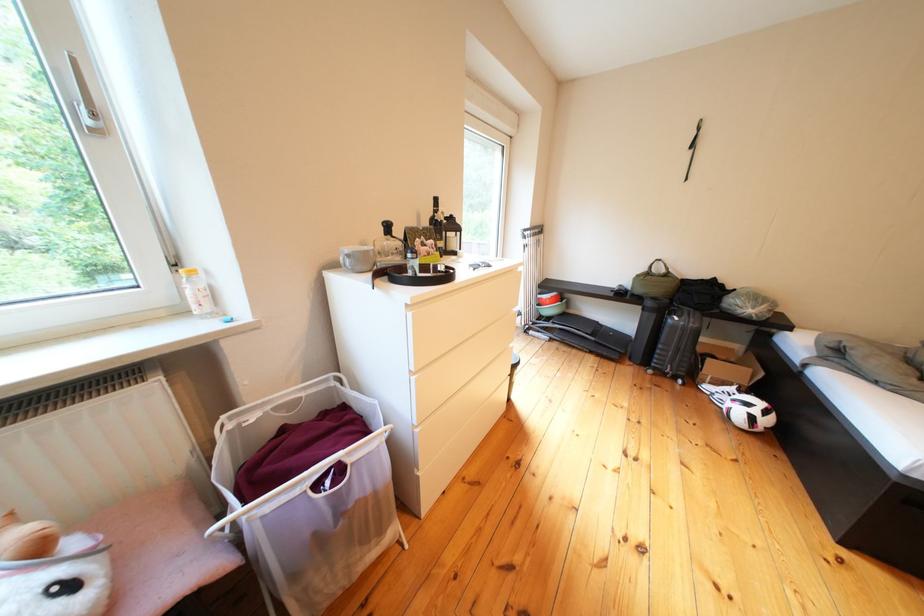
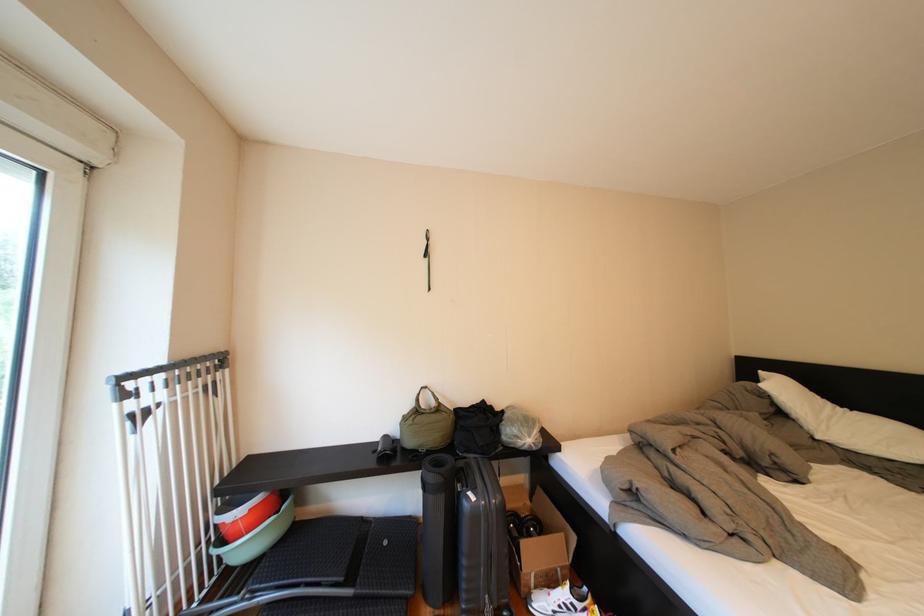
Locate, in the second image, the point that corresponds to the point at 723,365 in the first image.

(538, 548)